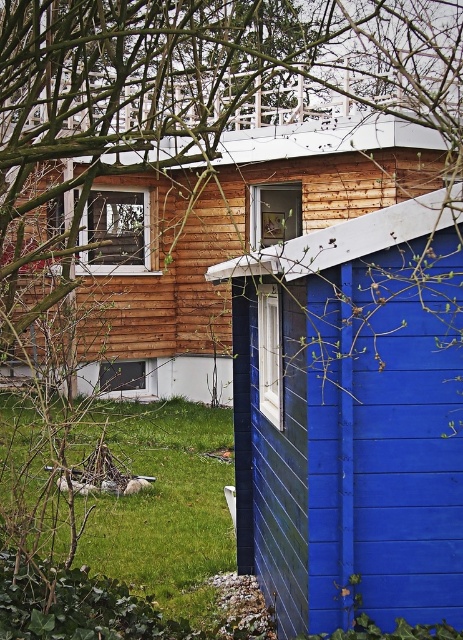
You are planning to place a new garden bench that is 2 meters wide between the blue wooden shed at right and the wooden cabin at center. Given their widths, can the bench fit in the space between them?

The blue wooden shed at right is wider than the wooden cabin at center. However, the exact widths aren not provided, so we cannot determine if the 2 meter bench will fit between them.

You are designing a garden layout for the wooden cabin at center and the green grass at lower left. Which area requires more space to accommodate plants?

The green grass at lower left requires more space to accommodate plants because it occupies more area than the wooden cabin at center.